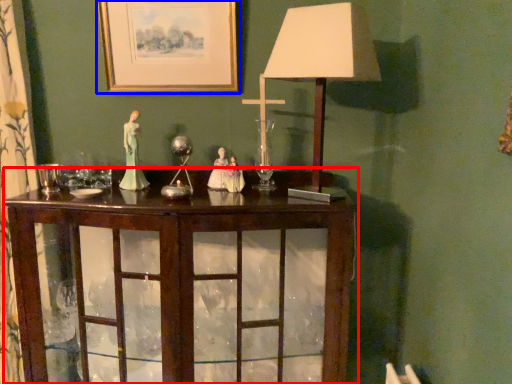
Question: Among these objects, which one is farthest to the camera, table (highlighted by a red box) or picture frame (highlighted by a blue box)?

Choices:
 (A) table
 (B) picture frame

Answer: (B)